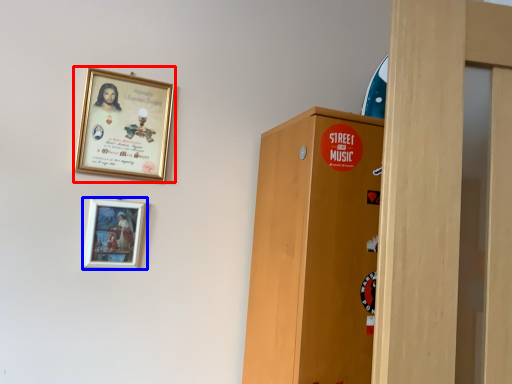
Question: Among these objects, which one is nearest to the camera, picture frame (highlighted by a red box) or picture frame (highlighted by a blue box)?

Choices:
 (A) picture frame
 (B) picture frame

Answer: (B)